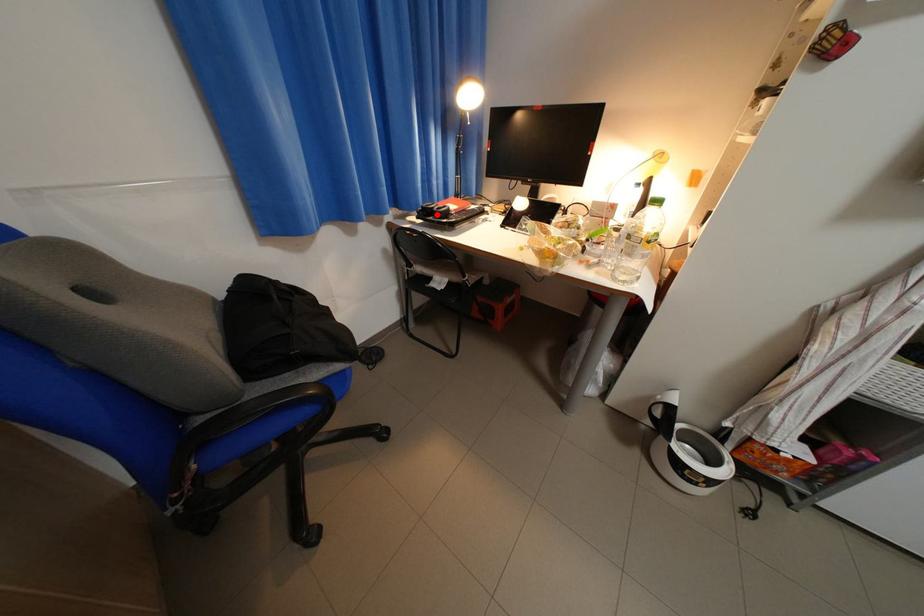
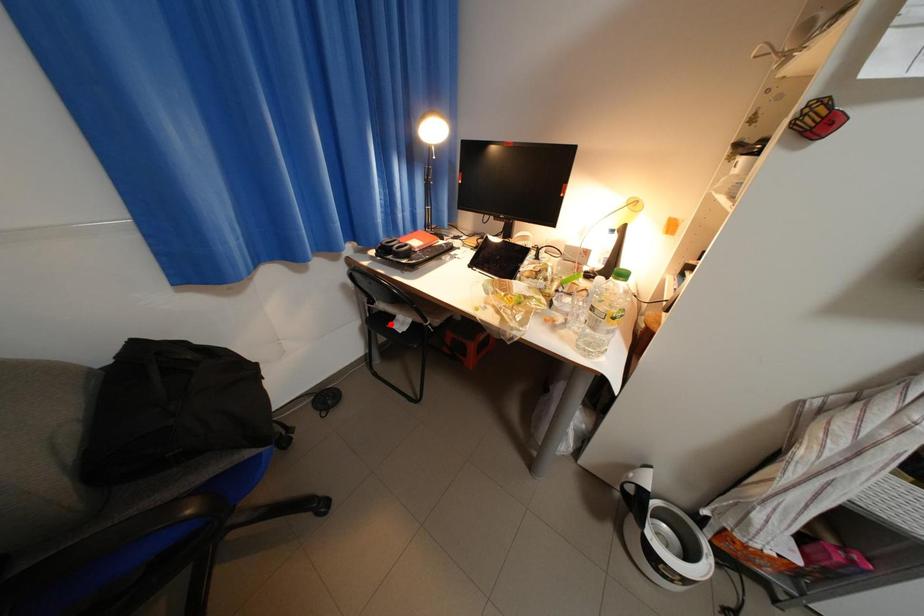
I am providing you with two images of the same scene from different viewpoints. A red point is marked on the first image and another point is marked on the second image. Is the red point in image1 aligned with the point shown in image2?

No